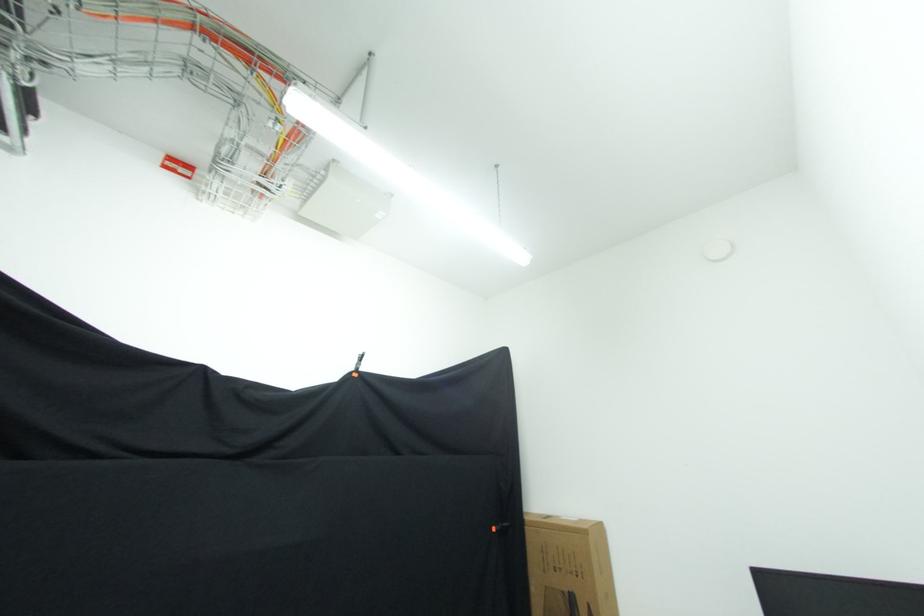
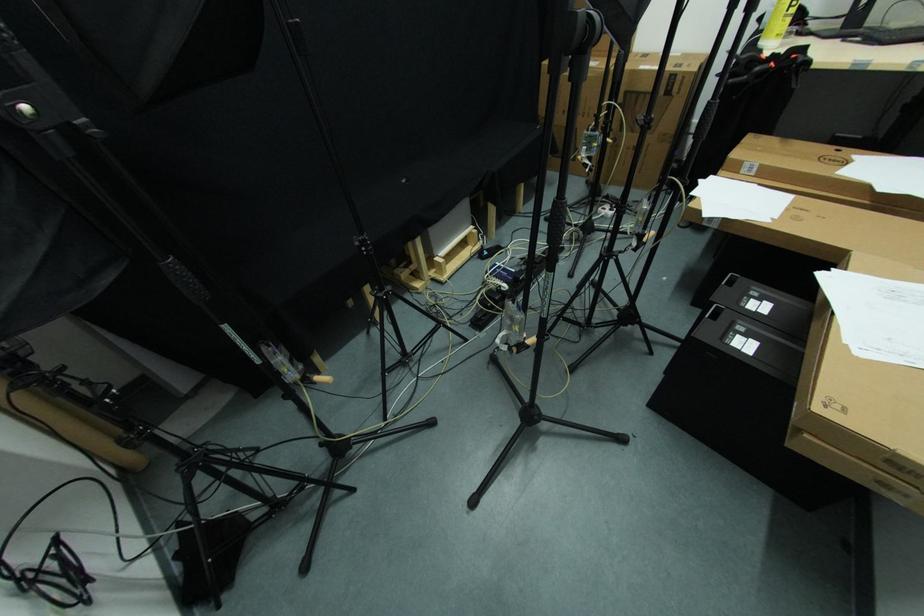
Question: The first image is from the beginning of the video and the second image is from the end. How did the camera likely rotate when shooting the video?

Choices:
 (A) Left
 (B) Right
 (C) Up
 (D) Down

Answer: (D)